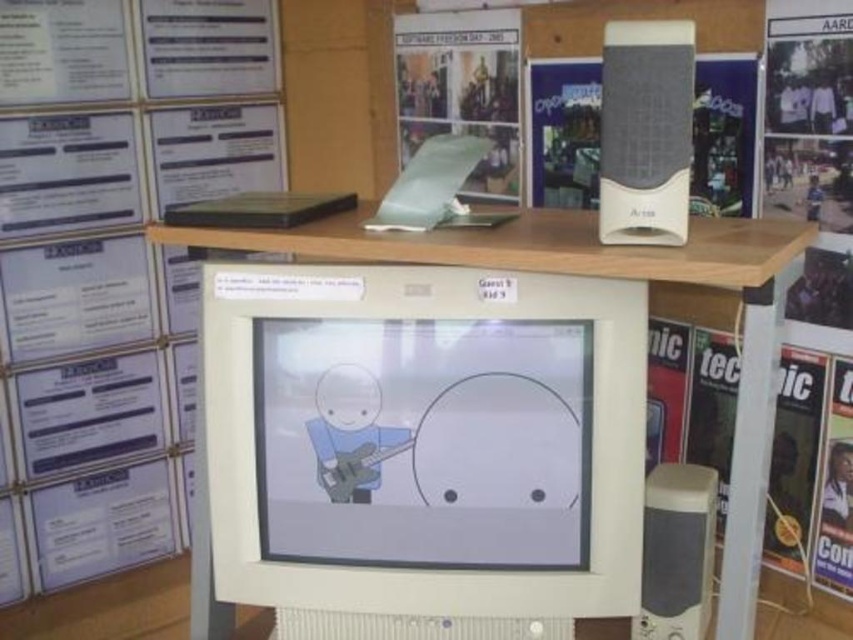
Which is more to the left, white paper at upper left or white plastic speaker at upper right?

white paper at upper left is more to the left.

Which of these two, white paper at upper left or white plastic speaker at upper right, stands shorter?

With less height is white plastic speaker at upper right.

Between point (90, 122) and point (659, 144), which one is positioned in front?

Point (659, 144)

The height and width of the screenshot is (640, 853). Find the location of `white paper at upper left`. white paper at upper left is located at coordinates (112, 262).

Which is above, white paper at upper left or white plastic speaker at lower right?

white paper at upper left

Is white paper at upper left to the left of white plastic speaker at lower right from the viewer's perspective?

Correct, you'll find white paper at upper left to the left of white plastic speaker at lower right.

Who is more forward, (160,289) or (677,531)?

Point (677,531)

Locate an element on the screen. white paper at upper left is located at coordinates (112, 262).

Does white plastic speaker at upper right come behind white plastic speaker at lower right?

No, white plastic speaker at upper right is closer to the viewer.

Where is `white plastic speaker at upper right`? Image resolution: width=853 pixels, height=640 pixels. white plastic speaker at upper right is located at coordinates (645, 131).

In order to click on white plastic speaker at upper right in this screenshot , I will do `click(645, 131)`.